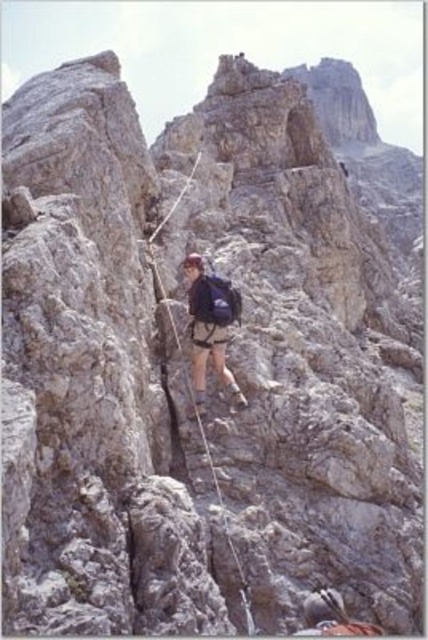
Does matte blue backpack at center appear over black nylon rope at center?

Yes, matte blue backpack at center is above black nylon rope at center.

Is point (226, 371) less distant than point (243, 602)?

That is False.

At what (x,y) coordinates should I click in order to perform the action: click on matte blue backpack at center. Please return your answer as a coordinate pair (x, y). This screenshot has width=428, height=640. Looking at the image, I should click on (211, 324).